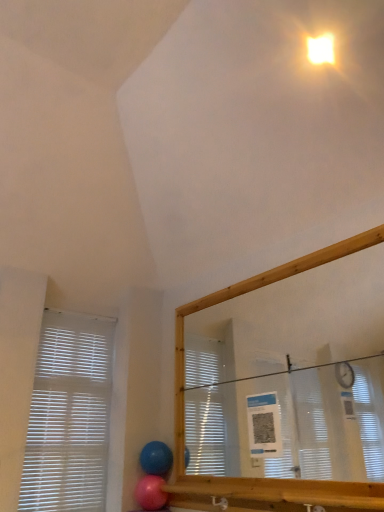
Question: Does blue rubber balloon at lower center, the second balloon from the bottom, appear on the left side of bright yellow plastic light at upper right?

Choices:
 (A) no
 (B) yes

Answer: (B)

Question: Does blue rubber balloon at lower center, the first balloon from the top, touch bright yellow plastic light at upper right?

Choices:
 (A) yes
 (B) no

Answer: (B)

Question: Is blue rubber balloon at lower center, the first balloon from the top, taller than bright yellow plastic light at upper right?

Choices:
 (A) yes
 (B) no

Answer: (A)

Question: Is blue rubber balloon at lower center, the second balloon from the bottom, facing towards bright yellow plastic light at upper right?

Choices:
 (A) no
 (B) yes

Answer: (A)

Question: Does blue rubber balloon at lower center, the second balloon from the bottom, have a larger size compared to bright yellow plastic light at upper right?

Choices:
 (A) no
 (B) yes

Answer: (B)

Question: Considering the positions of blue rubber balloon at lower center, the second balloon from the bottom, and bright yellow plastic light at upper right in the image, is blue rubber balloon at lower center, the second balloon from the bottom, taller or shorter than bright yellow plastic light at upper right?

Choices:
 (A) tall
 (B) short

Answer: (A)

Question: From the image's perspective, is blue rubber balloon at lower center, the second balloon from the bottom, positioned above or below bright yellow plastic light at upper right?

Choices:
 (A) below
 (B) above

Answer: (A)

Question: Is blue rubber balloon at lower center, the second balloon from the bottom, to the left or to the right of bright yellow plastic light at upper right in the image?

Choices:
 (A) left
 (B) right

Answer: (A)

Question: Based on their sizes in the image, would you say blue rubber balloon at lower center, the first balloon from the top, is bigger or smaller than bright yellow plastic light at upper right?

Choices:
 (A) small
 (B) big

Answer: (B)

Question: Considering the positions of bright yellow plastic light at upper right and blue rubber balloon at lower center, the second balloon from the bottom, in the image, is bright yellow plastic light at upper right taller or shorter than blue rubber balloon at lower center, the second balloon from the bottom,?

Choices:
 (A) tall
 (B) short

Answer: (B)

Question: Is bright yellow plastic light at upper right bigger or smaller than blue rubber balloon at lower center, the first balloon from the top?

Choices:
 (A) small
 (B) big

Answer: (A)

Question: In terms of width, does bright yellow plastic light at upper right look wider or thinner when compared to blue rubber balloon at lower center, the second balloon from the bottom?

Choices:
 (A) wide
 (B) thin

Answer: (B)

Question: From a real-world perspective, is bright yellow plastic light at upper right positioned above or below blue rubber balloon at lower center, the first balloon from the top?

Choices:
 (A) below
 (B) above

Answer: (B)

Question: Does point (69, 480) appear closer or farther from the camera than point (329, 37)?

Choices:
 (A) closer
 (B) farther

Answer: (B)

Question: Is white plastic blinds at left to the left or to the right of bright yellow plastic light at upper right in the image?

Choices:
 (A) right
 (B) left

Answer: (B)